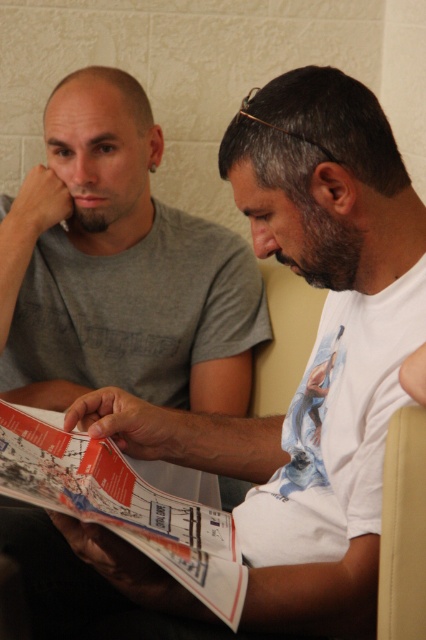
Question: Is the position of printed paper magazine at center more distant than that of beige fabric armchair at right?

Choices:
 (A) no
 (B) yes

Answer: (B)

Question: Does printed paper magazine at center lie behind beige fabric armchair at right?

Choices:
 (A) yes
 (B) no

Answer: (A)

Question: Which point is closer to the camera?

Choices:
 (A) (414, 564)
 (B) (230, 557)

Answer: (A)

Question: Considering the relative positions of printed paper magazine at center and beige fabric armchair at right in the image provided, where is printed paper magazine at center located with respect to beige fabric armchair at right?

Choices:
 (A) above
 (B) below

Answer: (B)

Question: Which point is farther to the camera?

Choices:
 (A) (416, 609)
 (B) (207, 586)

Answer: (B)